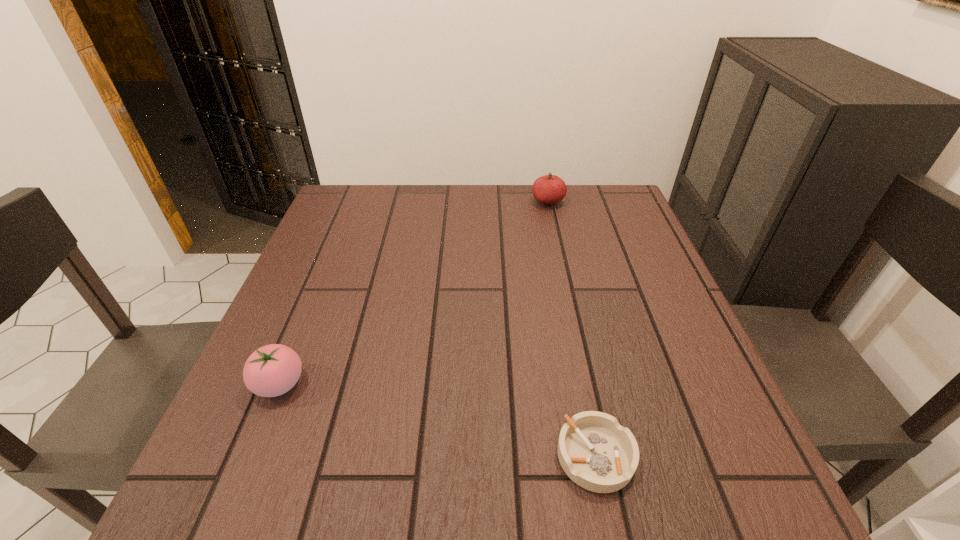
Locate an element on the screen. the farthest object is located at coordinates (549, 189).

Where is `the farther tomato`? This screenshot has height=540, width=960. the farther tomato is located at coordinates (549, 189).

What are the coordinates of `the second farthest object` in the screenshot? It's located at (272, 370).

At what (x,y) coordinates should I click in order to perform the action: click on the left tomato. Please return your answer as a coordinate pair (x, y). This screenshot has height=540, width=960. Looking at the image, I should click on (272, 370).

Locate an element on the screen. the nearest object is located at coordinates (598, 454).

Identify the location of the shortest object. 598,454.

You are a GUI agent. You are given a task and a screenshot of the screen. Output one action in this format:
    pyautogui.click(x=<x>, y=<y>)
    Task: Click on the vacant region located 0.160m on the front of the farthest object
    This screenshot has height=540, width=960.
    Given the screenshot: What is the action you would take?
    pyautogui.click(x=558, y=245)

Locate an element on the screen. free region located 0.380m on the right of the nearer tomato is located at coordinates (516, 384).

Locate an element on the screen. The height and width of the screenshot is (540, 960). vacant space located 0.260m on the back of the nearest object is located at coordinates (565, 310).

You are a GUI agent. You are given a task and a screenshot of the screen. Output one action in this format:
    pyautogui.click(x=<x>, y=<y>)
    Task: Click on the object that is at the far edge
    The height and width of the screenshot is (540, 960).
    Given the screenshot: What is the action you would take?
    pyautogui.click(x=549, y=189)